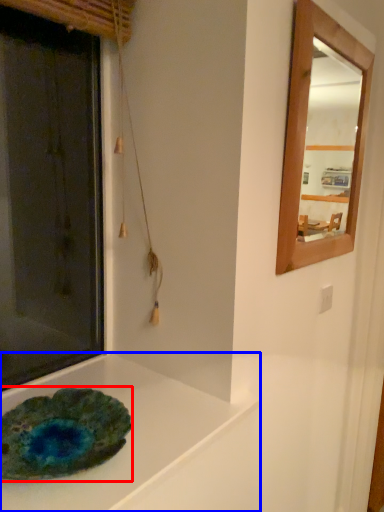
Question: Which of the following is the closest to the observer, glass plate (highlighted by a red box) or counter top (highlighted by a blue box)?

Choices:
 (A) glass plate
 (B) counter top

Answer: (B)